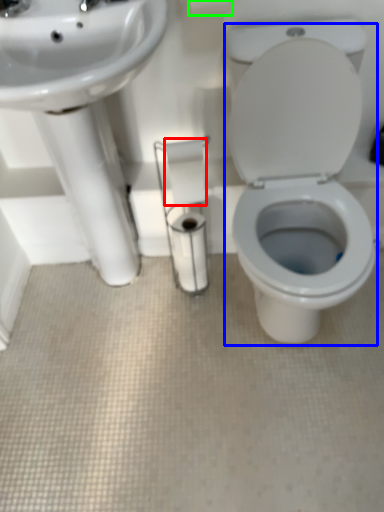
Question: Estimate the real-world distances between objects in this image. Which object is farther from toilet paper (highlighted by a red box), porcelain (highlighted by a blue box) or toilet paper (highlighted by a green box)?

Choices:
 (A) porcelain
 (B) toilet paper

Answer: (B)